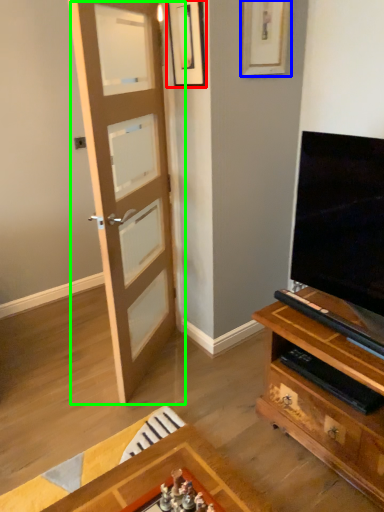
Question: Which object is positioned closest to picture frame (highlighted by a red box)? Select from picture frame (highlighted by a blue box) and door (highlighted by a green box).

Choices:
 (A) picture frame
 (B) door

Answer: (A)